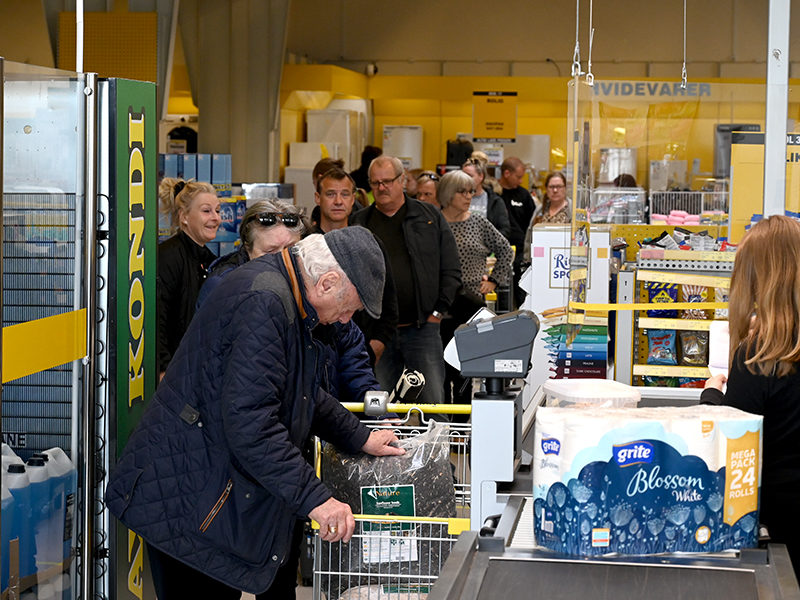
I want to click on crayola crayons jumbo hanging by register, so pyautogui.click(x=596, y=312), pyautogui.click(x=596, y=316), pyautogui.click(x=594, y=326), pyautogui.click(x=594, y=337), pyautogui.click(x=597, y=344), pyautogui.click(x=596, y=351), pyautogui.click(x=594, y=361), pyautogui.click(x=594, y=370), pyautogui.click(x=594, y=372).